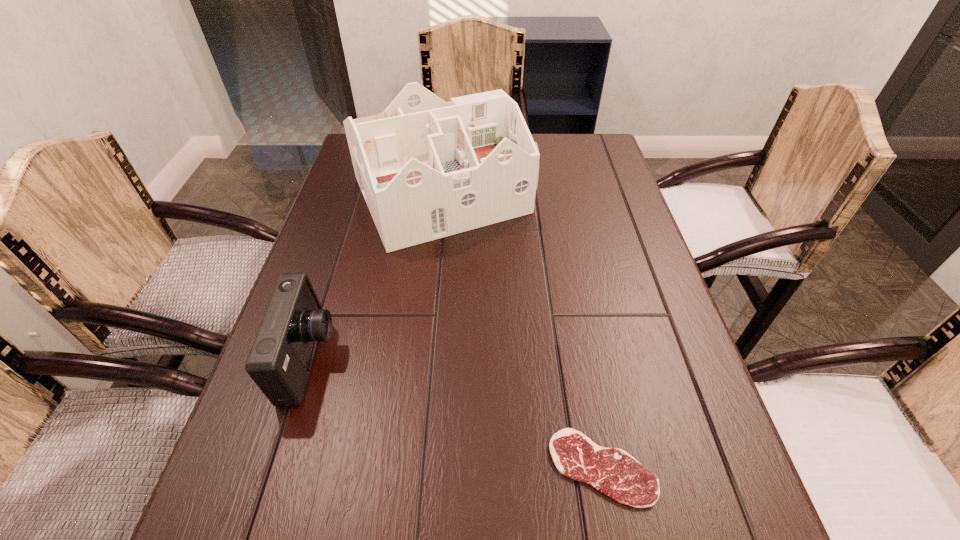
Locate an element on the screen. The height and width of the screenshot is (540, 960). dollhouse that is positioned at the left edge is located at coordinates (428, 169).

Where is `camera that is at the left edge`? Image resolution: width=960 pixels, height=540 pixels. camera that is at the left edge is located at coordinates (280, 360).

At what (x,y) coordinates should I click in order to perform the action: click on object that is positioned at the right edge. Please return your answer as a coordinate pair (x, y). Looking at the image, I should click on (612, 471).

Image resolution: width=960 pixels, height=540 pixels. I want to click on object present at the far left corner, so click(428, 169).

You are a GUI agent. You are given a task and a screenshot of the screen. Output one action in this format:
    pyautogui.click(x=<x>, y=<y>)
    Task: Click on the vacant position at the far edge of the desktop
    This screenshot has width=960, height=540.
    Given the screenshot: What is the action you would take?
    pyautogui.click(x=555, y=146)

Find the location of a particular element. free space at the left edge of the desktop is located at coordinates (320, 267).

Find the location of a particular element. Image resolution: width=960 pixels, height=540 pixels. blank space at the right edge of the desktop is located at coordinates (607, 195).

This screenshot has height=540, width=960. In the image, there is a desktop. What are the coordinates of `vacant space at the far right corner` in the screenshot? It's located at (578, 146).

Locate an element on the screen. This screenshot has width=960, height=540. empty space that is in between the camera and the steak is located at coordinates (456, 413).

The height and width of the screenshot is (540, 960). In order to click on empty space between the steak and the dollhouse in this screenshot , I will do `click(522, 331)`.